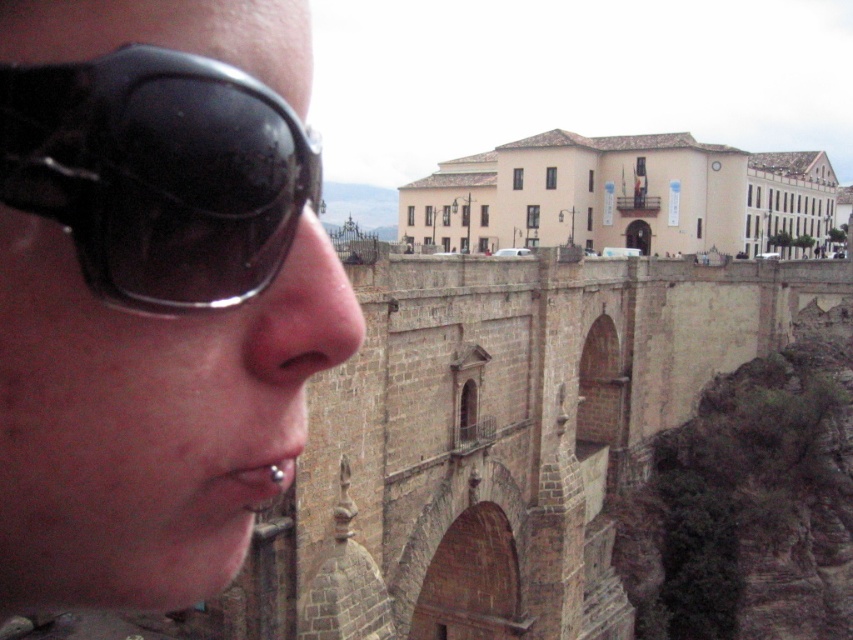
You are a photographer trying to capture a portrait of the person wearing the black shiny sunglasses at left and the matte skin nose at center. Which object should you focus on first if you want to ensure both are in sharp focus?

The black shiny sunglasses at left is not as tall as the matte skin nose at center, so you should focus on the matte skin nose at center first to ensure both are in sharp focus.

You are a photographer trying to capture the historic stone bridge and the large beige building in the background. You notice two points marked on your camera screen at coordinates point (535,545) and point (277,461). Which point is closer to the bridge and the building?

Point (277,461) is closer to the bridge and the building because point (535,545) is behind it.

You are a photographer trying to capture a photo of the brown stone viaduct at center and the silver metallic piercing at lower left. If your camera can focus on objects up to 40 meters away, will both objects be in focus?

The brown stone viaduct at center is 38.95 meters away from the silver metallic piercing at lower left. Since the camera can focus up to 40 meters, both objects are within the focusing range and will be in focus.